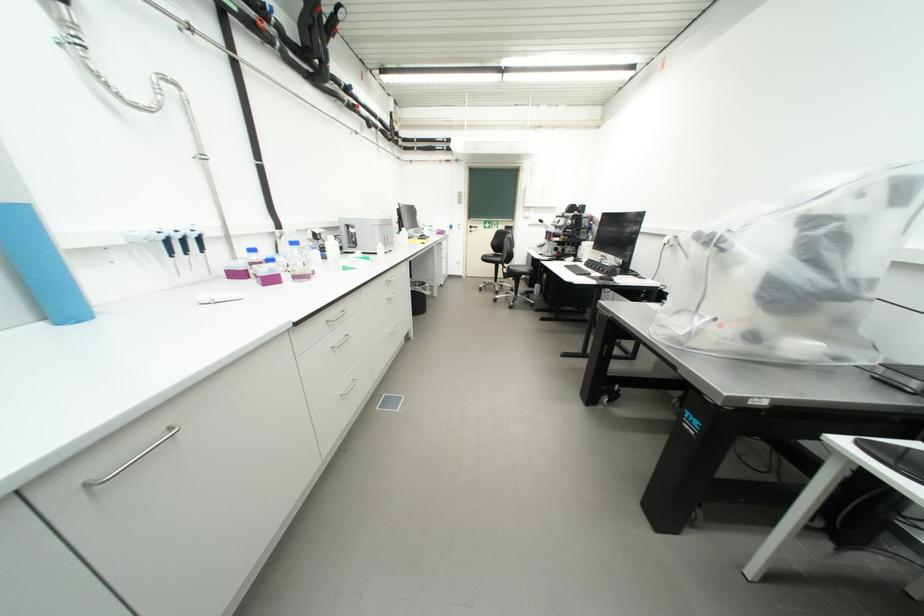
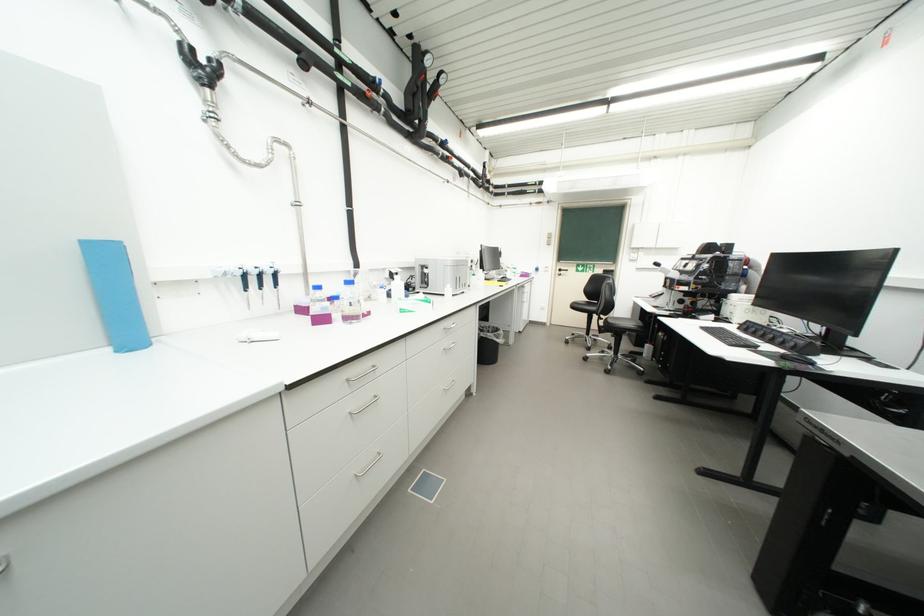
The point at (514, 272) is marked in the first image. Where is the corresponding point in the second image?

(610, 325)